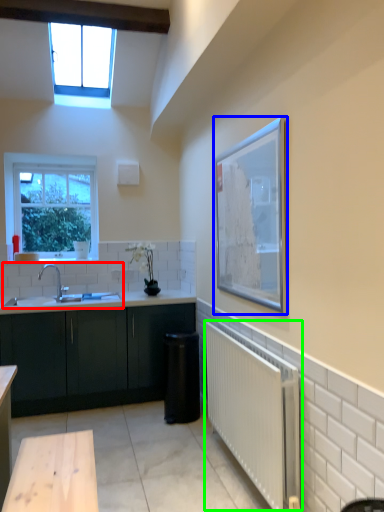
Question: Estimate the real-world distances between objects in this image. Which object is farther from sink (highlighted by a red box), picture frame (highlighted by a blue box) or radiator (highlighted by a green box)?

Choices:
 (A) picture frame
 (B) radiator

Answer: (A)